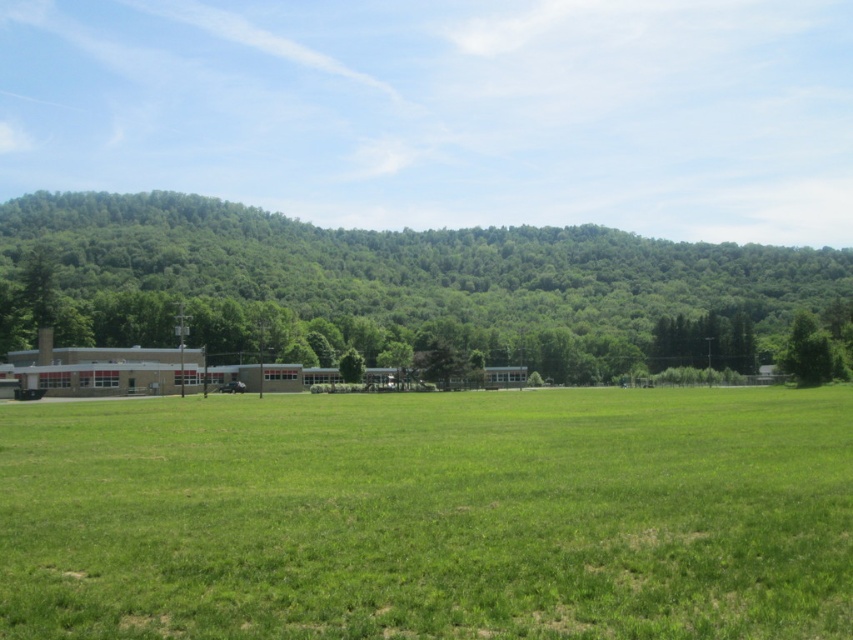
Question: In this image, where is green grass at center located relative to green leafy tree at left?

Choices:
 (A) right
 (B) left

Answer: (A)

Question: Which is nearer to the green leafy tree at right?

Choices:
 (A) green grass at center
 (B) green leafy tree at left

Answer: (A)

Question: Which point is farther to the camera?

Choices:
 (A) click(x=91, y=513)
 (B) click(x=624, y=301)
 (C) click(x=828, y=358)

Answer: (B)

Question: Is the position of green grass at center more distant than that of green leafy tree at right?

Choices:
 (A) yes
 (B) no

Answer: (B)

Question: Among these points, which one is nearest to the camera?

Choices:
 (A) (390, 525)
 (B) (828, 374)

Answer: (A)

Question: Is green leafy tree at left further to the viewer compared to green leafy tree at right?

Choices:
 (A) no
 (B) yes

Answer: (B)